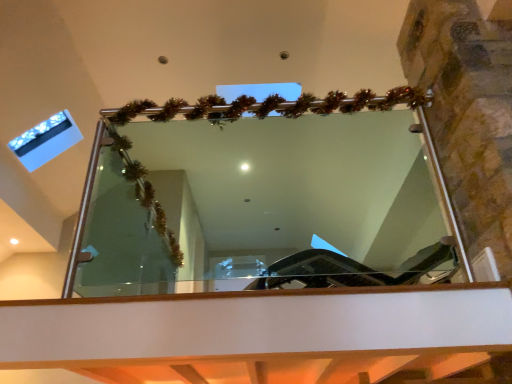
Question: From a real-world perspective, is transparent glass window at upper left physically located above or below clear glass mirror at center?

Choices:
 (A) below
 (B) above

Answer: (B)

Question: Considering the positions of transparent glass window at upper left and clear glass mirror at center in the image, is transparent glass window at upper left taller or shorter than clear glass mirror at center?

Choices:
 (A) tall
 (B) short

Answer: (B)

Question: Is transparent glass window at upper left in front of or behind clear glass mirror at center in the image?

Choices:
 (A) front
 (B) behind

Answer: (B)

Question: Is clear glass mirror at center inside or outside of transparent glass window at upper left?

Choices:
 (A) inside
 (B) outside

Answer: (B)

Question: Looking at the image, does clear glass mirror at center seem bigger or smaller compared to transparent glass window at upper left?

Choices:
 (A) big
 (B) small

Answer: (A)

Question: Relative to transparent glass window at upper left, is clear glass mirror at center in front or behind?

Choices:
 (A) front
 (B) behind

Answer: (A)

Question: Is clear glass mirror at center wider or thinner than transparent glass window at upper left?

Choices:
 (A) wide
 (B) thin

Answer: (A)